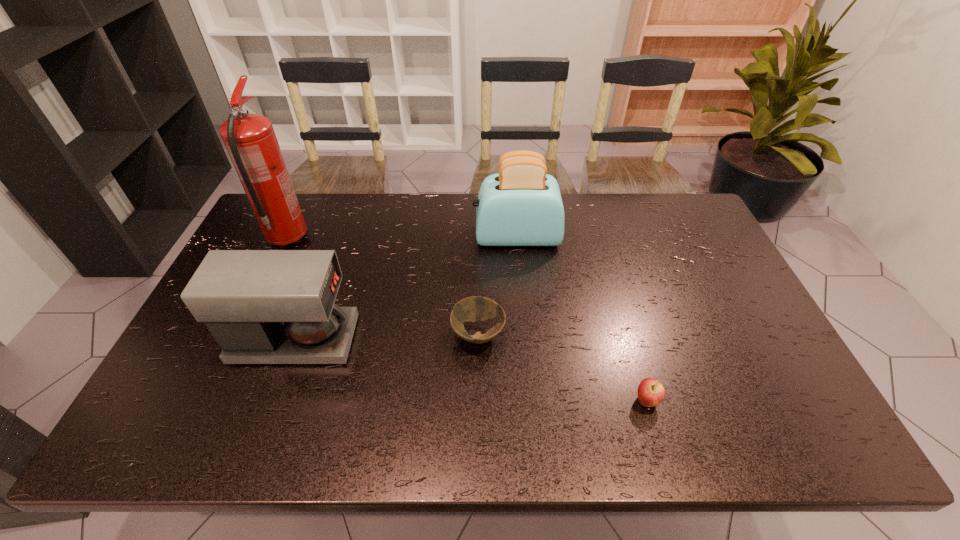
What are the coordinates of `object situated at the far left corner` in the screenshot? It's located at (250, 140).

This screenshot has height=540, width=960. In order to click on vacant area at the far edge of the desktop in this screenshot , I will do `click(610, 199)`.

I want to click on vacant space at the right edge of the desktop, so click(x=708, y=309).

What are the coordinates of `free space between the tallest object and the bowl` in the screenshot? It's located at (x=383, y=287).

Locate an element on the screen. This screenshot has height=540, width=960. blank region between the shortest object and the coffee maker is located at coordinates (386, 337).

This screenshot has height=540, width=960. What are the coordinates of `vacant point located between the shortest object and the coffee maker` in the screenshot? It's located at (386, 337).

You are a GUI agent. You are given a task and a screenshot of the screen. Output one action in this format:
    pyautogui.click(x=<x>, y=<y>)
    Task: Click on the vacant region between the coffee maker and the toaster
    This screenshot has width=960, height=540.
    Given the screenshot: What is the action you would take?
    pyautogui.click(x=405, y=288)

Find the location of a particular element. empty space between the fire extinguisher and the second tallest object is located at coordinates (402, 238).

Locate an element on the screen. This screenshot has height=540, width=960. vacant area between the coffee maker and the nearest object is located at coordinates (470, 370).

Identify the location of vacant region between the third shortest object and the bowl. The image size is (960, 540). (386, 337).